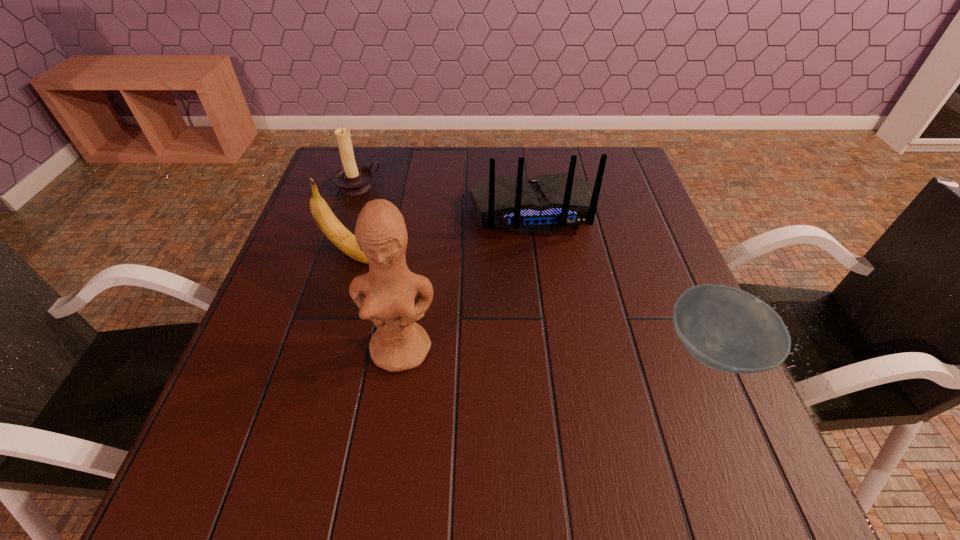
Where is `vacant point located between the figurine and the fourth object from left to right`? Image resolution: width=960 pixels, height=540 pixels. vacant point located between the figurine and the fourth object from left to right is located at coordinates (467, 280).

The height and width of the screenshot is (540, 960). I want to click on the second closest object relative to the figurine, so click(548, 203).

At what (x,y) coordinates should I click in order to perform the action: click on the second closest object to the candle holder. Please return your answer as a coordinate pair (x, y). This screenshot has width=960, height=540. Looking at the image, I should click on (548, 203).

Find the location of `vacant space that satisfies the following two spatial constraints: 1. on the front side of the banana; 2. on the right side of the bowl`. vacant space that satisfies the following two spatial constraints: 1. on the front side of the banana; 2. on the right side of the bowl is located at coordinates (323, 350).

This screenshot has height=540, width=960. In order to click on vacant area that satisfies the following two spatial constraints: 1. on the front-facing side of the rightmost object; 2. on the left side of the tallest object in this screenshot , I will do `click(401, 350)`.

Identify the location of vacant space that satisfies the following two spatial constraints: 1. on the front-facing side of the rightmost object; 2. on the right side of the figurine. (401, 350).

The image size is (960, 540). Identify the location of vacant point that satisfies the following two spatial constraints: 1. on the back side of the fourth object from left to right; 2. on the left side of the banana. (364, 212).

The height and width of the screenshot is (540, 960). Find the location of `vacant space that satisfies the following two spatial constraints: 1. on the back side of the banana; 2. on the right side of the fourth object from left to right`. vacant space that satisfies the following two spatial constraints: 1. on the back side of the banana; 2. on the right side of the fourth object from left to right is located at coordinates click(x=364, y=212).